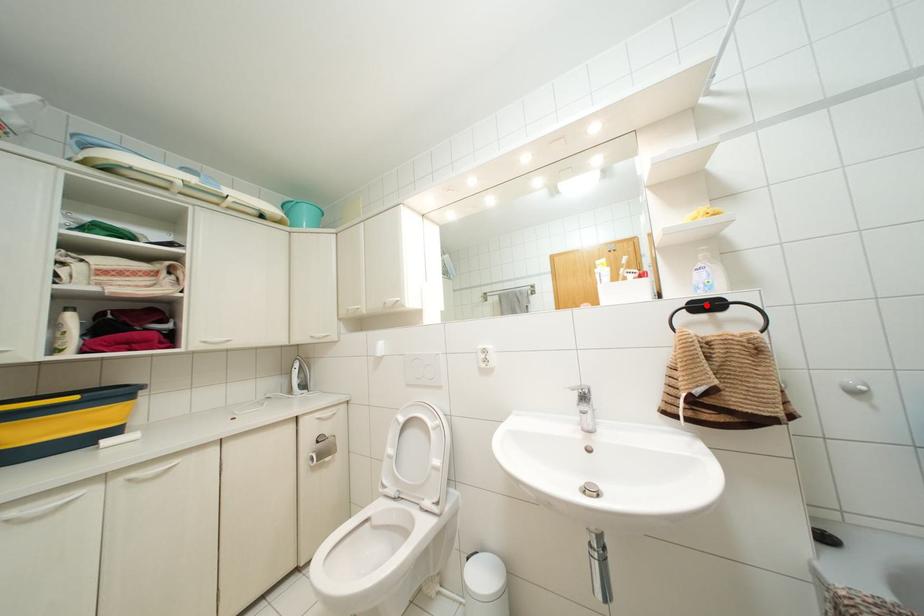
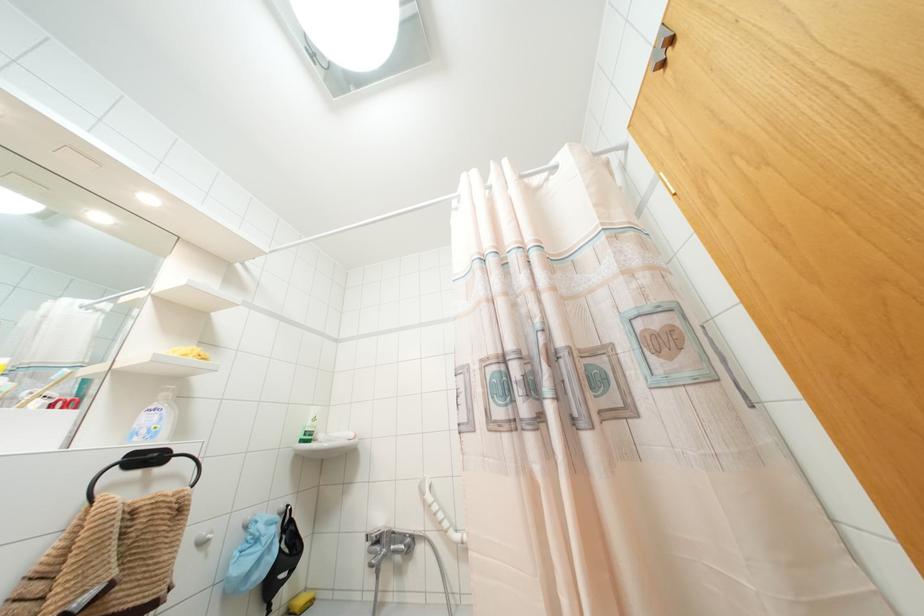
Locate, in the second image, the point that corresponds to the highlighted location in the first image.

(147, 458)